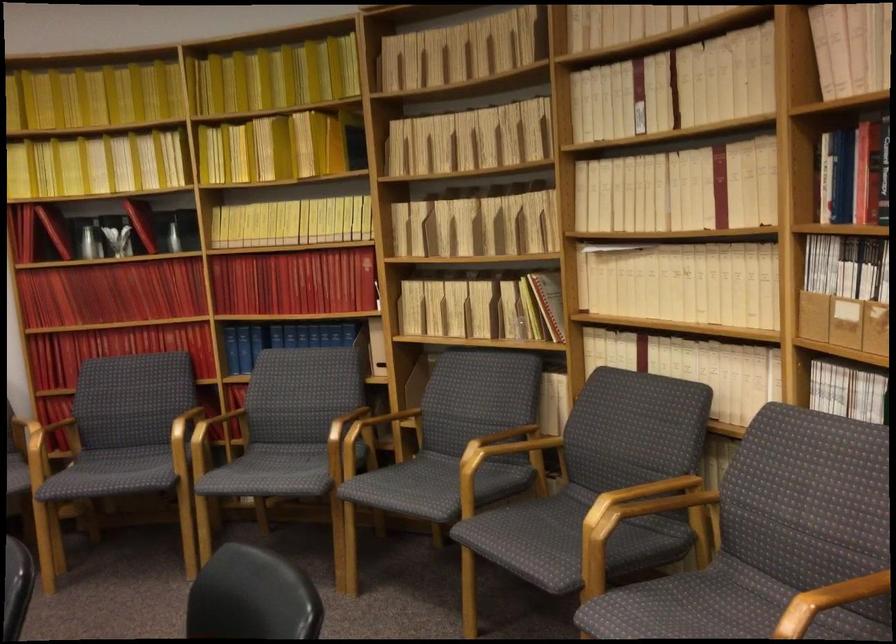
Identify the location of silver pitcher. (90, 243).